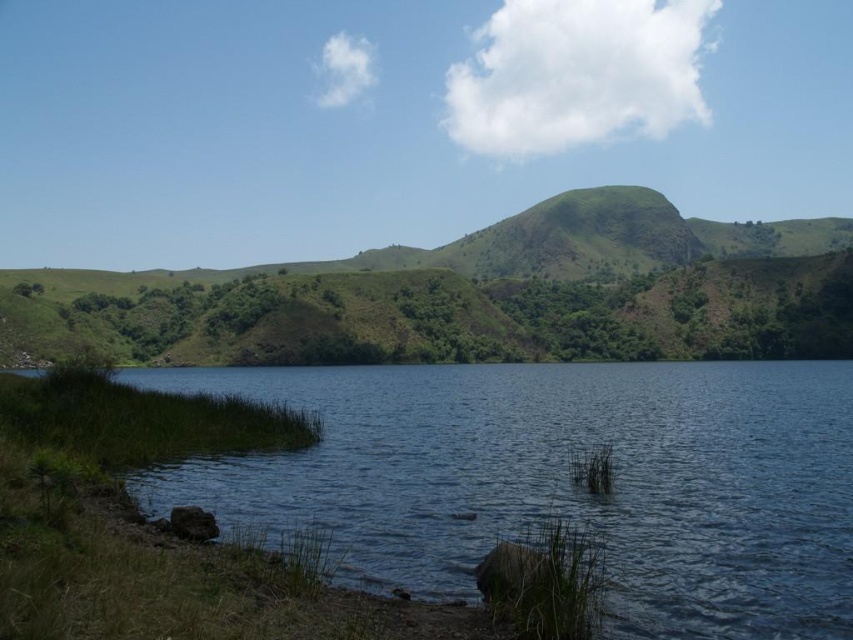
You are standing at the edge of the clear water at lower left and want to walk to the green grassy hill at center. Which direction should you head towards?

You should head towards the center direction because the clear water at lower left is smaller than the green grassy hill at center, indicating the hill is further away and requires moving towards the center.

You are standing at the center of the image and want to walk towards the clear water at lower left. Which direction should you head in to reach it?

The clear water at lower left is located at point [560,481], so you should head towards the lower left direction to reach it.